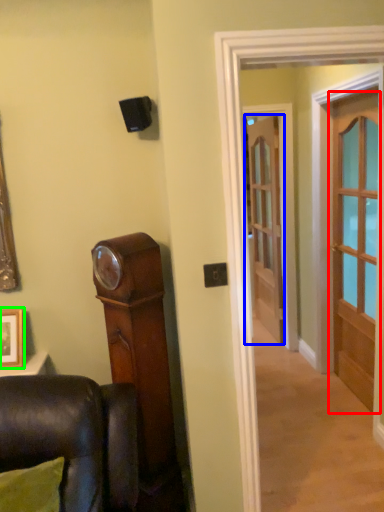
Question: Which object is the farthest from door (highlighted by a red box)? Choose among these: door (highlighted by a blue box) or picture frame (highlighted by a green box).

Choices:
 (A) door
 (B) picture frame

Answer: (B)